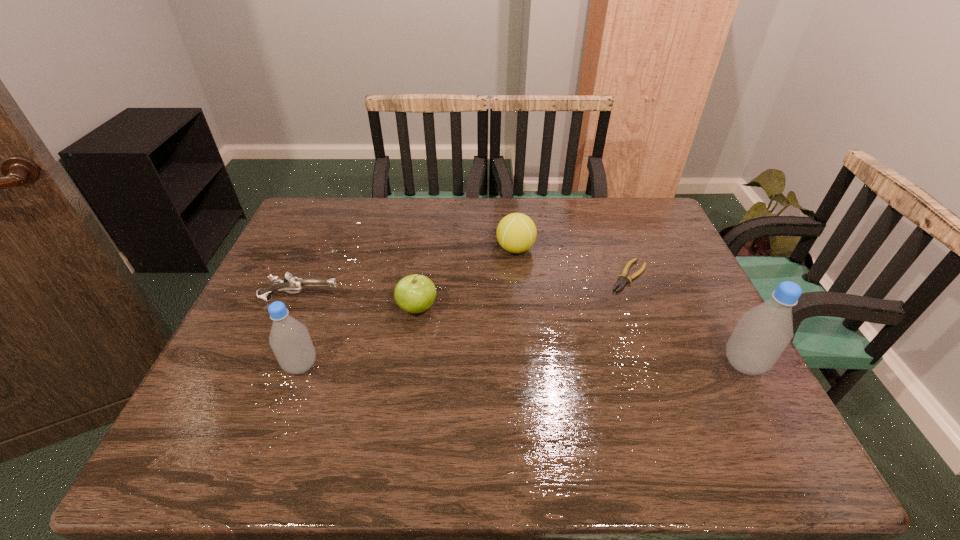
Locate an element on the screen. The image size is (960, 540). vacant space that satisfies the following two spatial constraints: 1. on the front side of the rightmost object; 2. on the left side of the shortest object is located at coordinates [x=661, y=364].

You are a GUI agent. You are given a task and a screenshot of the screen. Output one action in this format:
    pyautogui.click(x=<x>, y=<y>)
    Task: Click on the free spot that satisfies the following two spatial constraints: 1. aimed along the barrel of the fifth tallest object; 2. on the left side of the fifth shortest object
    This screenshot has height=540, width=960.
    Given the screenshot: What is the action you would take?
    pyautogui.click(x=272, y=365)

Where is `vacant space that satisfies the following two spatial constraints: 1. on the front side of the tennis ball; 2. aimed along the barrel of the gun`? The width and height of the screenshot is (960, 540). vacant space that satisfies the following two spatial constraints: 1. on the front side of the tennis ball; 2. aimed along the barrel of the gun is located at coordinates (520, 299).

Find the location of a particular element. The width and height of the screenshot is (960, 540). free space that satisfies the following two spatial constraints: 1. aimed along the barrel of the apple; 2. on the right side of the second shortest object is located at coordinates (296, 308).

This screenshot has width=960, height=540. Find the location of `free spot that satisfies the following two spatial constraints: 1. on the front side of the right bottle; 2. on the left side of the third object from left to right`. free spot that satisfies the following two spatial constraints: 1. on the front side of the right bottle; 2. on the left side of the third object from left to right is located at coordinates (409, 364).

Image resolution: width=960 pixels, height=540 pixels. What are the coordinates of `free space that satisfies the following two spatial constraints: 1. aimed along the barrel of the second shortest object; 2. on the back side of the right bottle` in the screenshot? It's located at (272, 364).